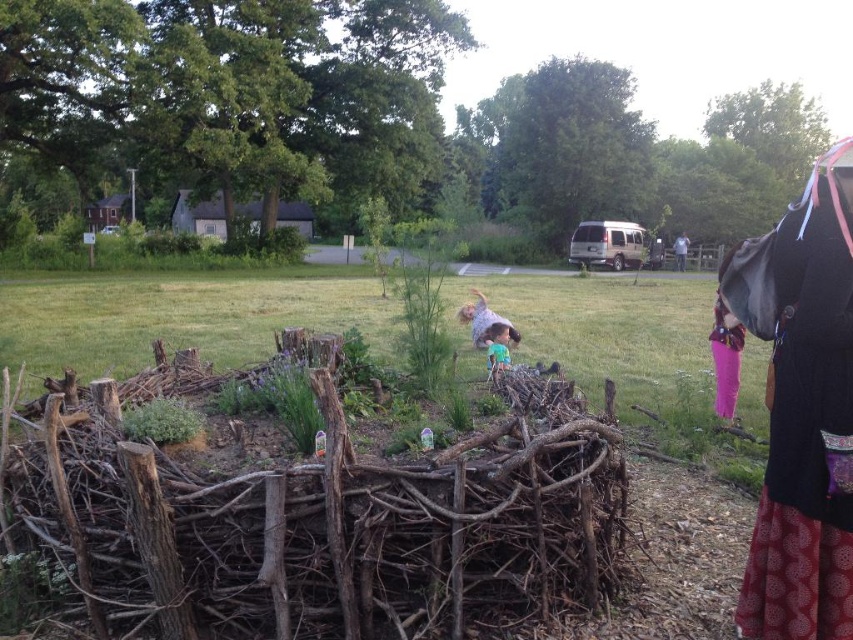
You are a parent supervising children in the park. You notice the wooden hut at upper left and the light blue shirt at center. Which object is taller?

The wooden hut at upper left is taller than the light blue shirt at center.

You are a parent supervising children in the park. You want to ensure the wooden hut at upper left and the green leafy plant at center are visible to you at all times. Which object should you position yourself closer to in order to monitor both effectively?

You should position yourself closer to the green leafy plant at center because the wooden hut at upper left is larger and can be seen from a distance, while the smaller green leafy plant at center requires closer proximity to monitor effectively.